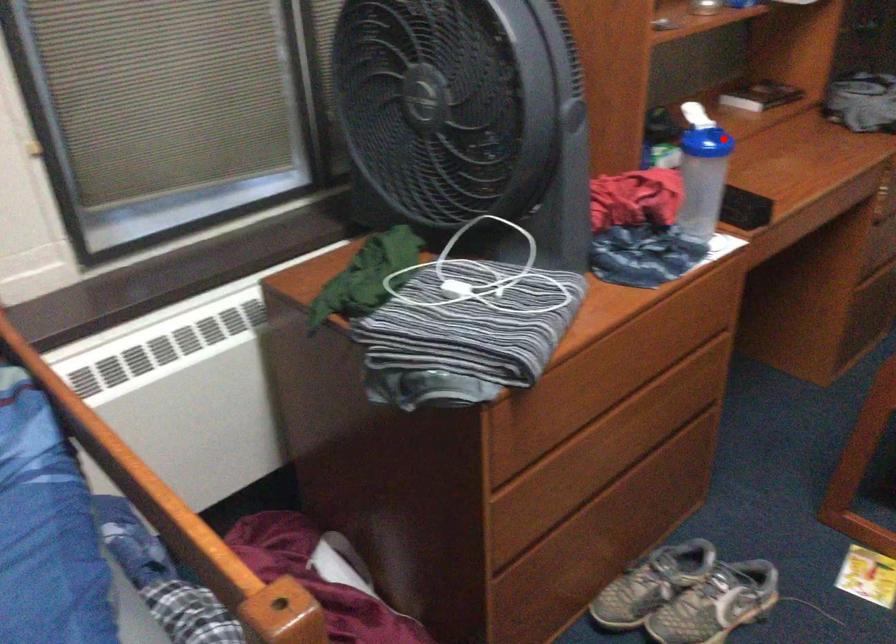
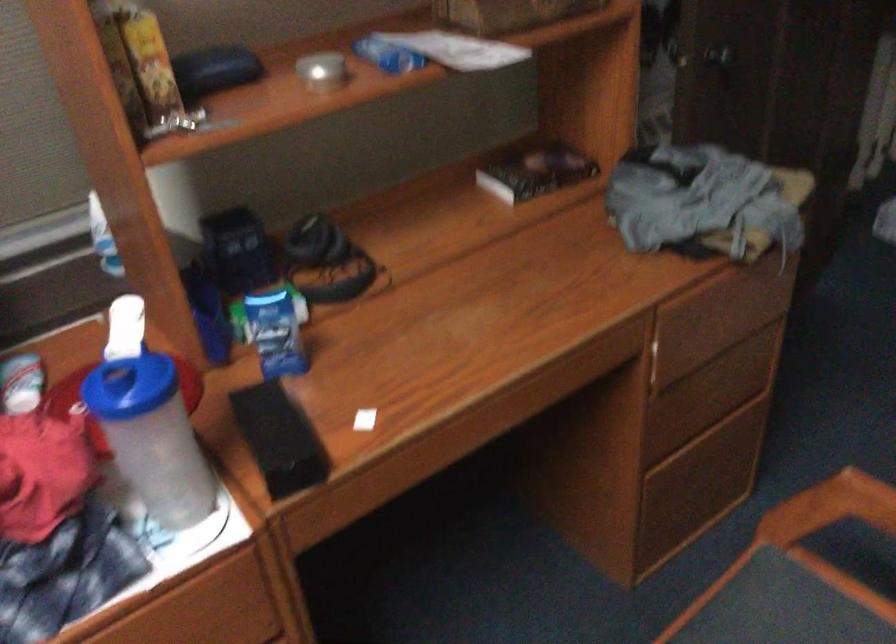
Where in the second image is the point corresponding to the highlighted location from the first image?

(130, 386)